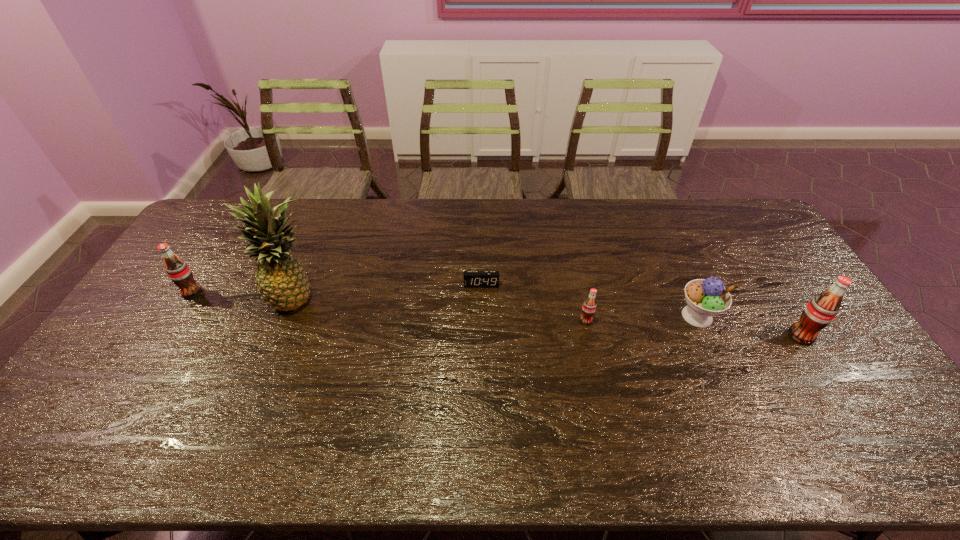
Image resolution: width=960 pixels, height=540 pixels. What are the coordinates of `vacant position in the image that satisfies the following two spatial constraints: 1. on the front-facing side of the alarm clock; 2. on the right side of the icecream` in the screenshot? It's located at (481, 316).

Identify the location of vacant region that satisfies the following two spatial constraints: 1. on the front side of the pineapple; 2. on the left side of the third object from right to left. (287, 321).

This screenshot has width=960, height=540. In order to click on vacant space that satisfies the following two spatial constraints: 1. on the front-facing side of the nearest soda; 2. on the right side of the alarm clock in this screenshot , I will do pos(481,336).

Locate an element on the screen. This screenshot has height=540, width=960. blank area in the image that satisfies the following two spatial constraints: 1. on the front-facing side of the fourth object from right to left; 2. on the right side of the second object from right to left is located at coordinates (481, 316).